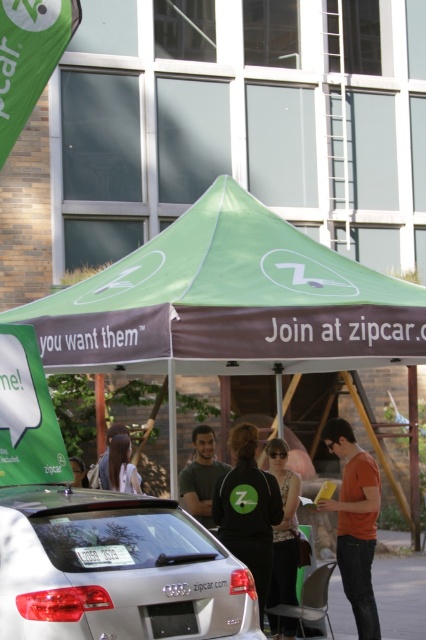
Question: Does black textured shirt at center have a greater width compared to matte black jacket at center?

Choices:
 (A) no
 (B) yes

Answer: (B)

Question: Where is black textured shirt at center located in relation to dark brown hair at center in the image?

Choices:
 (A) left
 (B) right

Answer: (B)

Question: Which object appears closest to the camera in this image?

Choices:
 (A) matte green t-shirt at center
 (B) dark brown hair at center

Answer: (A)

Question: Which point appears closest to the camera in this image?

Choices:
 (A) (256, 484)
 (B) (104, 452)
 (C) (344, 564)

Answer: (A)

Question: Is green fabric tent at center to the right of orange cotton t-shirt at center from the viewer's perspective?

Choices:
 (A) no
 (B) yes

Answer: (A)

Question: Which point is closer to the camera?

Choices:
 (A) black textured shirt at center
 (B) matte green t-shirt at center
 (C) satin silver car at center

Answer: (C)